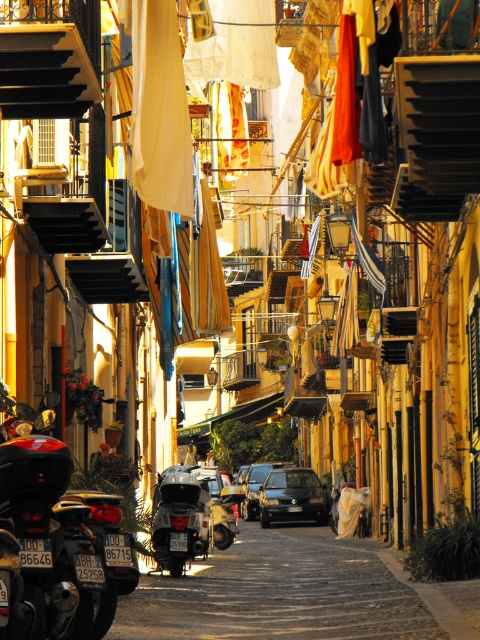
You are a delivery person needing to park your scooter in the center of the street. The shiny metallic scooter at center is already parked. Can you park your scooter next to it without overlapping?

The shiny metallic scooter at center is located at point (179,518), so yes, you can park your scooter next to it as long as you position it adjacent to those coordinates without overlapping.

You are standing at the entrance of the street and see a point marked at coordinates (291, 497). Based on the scene description, which object is this point located on?

The point at coordinates (291, 497) is located on the shiny dark blue sedan at center.

You are a delivery person trying to park your 1.8 meters wide delivery cart in the street. You see the shiny metallic scooter at center and the shiny blue sedan at center. Which vehicle takes up less space on the street?

The shiny metallic scooter at center takes up less space on the street because its width is less than the shiny blue sedan at center.